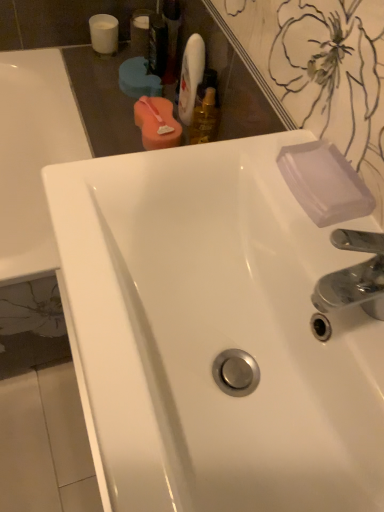
What do you see at coordinates (104, 33) in the screenshot? Image resolution: width=384 pixels, height=512 pixels. I see `white matte cup at upper left, the first mouthwash in the left-to-right sequence` at bounding box center [104, 33].

Describe the element at coordinates (140, 32) in the screenshot. The height and width of the screenshot is (512, 384). I see `clear plastic bottle at upper center, the second mouthwash from the left` at that location.

What do you see at coordinates (190, 77) in the screenshot? I see `translucent plastic mouthwash at upper center, the second mouthwash from the right` at bounding box center [190, 77].

Locate an element on the screen. The height and width of the screenshot is (512, 384). white glossy sink at center is located at coordinates tap(215, 334).

The width and height of the screenshot is (384, 512). What do you see at coordinates (215, 334) in the screenshot?
I see `white glossy sink at center` at bounding box center [215, 334].

This screenshot has width=384, height=512. I want to click on white matte cup at upper left, the first mouthwash in the left-to-right sequence, so click(104, 33).

Could you measure the distance between gold metallic mouthwash at upper center, which is the sixth mouthwash from left to right, and pink sponge at upper center, acting as the fourth mouthwash starting from the left?

They are 8.44 centimeters apart.

Is gold metallic mouthwash at upper center, which is the 1th mouthwash from right to left, next to pink sponge at upper center, acting as the fourth mouthwash starting from the left, and touching it?

Yes, gold metallic mouthwash at upper center, which is the 1th mouthwash from right to left, is next to pink sponge at upper center, acting as the fourth mouthwash starting from the left.

In the image, there is a pink sponge at upper center, acting as the fourth mouthwash starting from the left. At what (x,y) coordinates should I click in order to perform the action: click on mouthwash below it (from the image's perspective). Please return your answer as a coordinate pair (x, y). The width and height of the screenshot is (384, 512). Looking at the image, I should click on (205, 119).

Considering the positions of points (217, 130) and (168, 141), is point (217, 130) farther from camera compared to point (168, 141)?

No, (217, 130) is in front of (168, 141).

Is white glossy sink at center facing away from gold metallic mouthwash at upper center, which is the sixth mouthwash from left to right?

No, white glossy sink at center's orientation is not away from gold metallic mouthwash at upper center, which is the sixth mouthwash from left to right.

Between white glossy sink at center and gold metallic mouthwash at upper center, which is the sixth mouthwash from left to right, which one has larger width?

With larger width is white glossy sink at center.

Can you tell me how much white glossy sink at center and gold metallic mouthwash at upper center, which is the 1th mouthwash from right to left, differ in facing direction?

The facing directions of white glossy sink at center and gold metallic mouthwash at upper center, which is the 1th mouthwash from right to left, are 0.14 degrees apart.

Which is behind, point (95, 345) or point (198, 118)?

The point (198, 118) is farther.

Is gold metallic mouthwash at upper center, which is the 1th mouthwash from right to left, surrounded by clear plastic bottle at upper center, which is counted as the fifth mouthwash, starting from the right?

No.

Find the location of a particular element. mouthwash that is the 5th object located below the clear plastic bottle at upper center, which is counted as the fifth mouthwash, starting from the right (from the image's perspective) is located at coordinates (205, 119).

Between clear plastic bottle at upper center, the second mouthwash from the left, and gold metallic mouthwash at upper center, which is the sixth mouthwash from left to right, which one is positioned in front?

gold metallic mouthwash at upper center, which is the sixth mouthwash from left to right, is closer to the camera.

Is there a large distance between transparent plastic mouthwash at upper center, which is the third mouthwash from left to right, and pink sponge at upper center, marked as the third mouthwash in a right-to-left arrangement?

No.

Between point (153, 15) and point (153, 116), which one is positioned in front?

The point (153, 116) is in front.

Looking at the image, does transparent plastic mouthwash at upper center, which is the third mouthwash from left to right, seem bigger or smaller compared to pink sponge at upper center, acting as the fourth mouthwash starting from the left?

Clearly, transparent plastic mouthwash at upper center, which is the third mouthwash from left to right, is smaller in size than pink sponge at upper center, acting as the fourth mouthwash starting from the left.

From the image's perspective, does transparent plastic mouthwash at upper center, which is the third mouthwash from left to right, appear higher than pink sponge at upper center, marked as the third mouthwash in a right-to-left arrangement?

Correct, transparent plastic mouthwash at upper center, which is the third mouthwash from left to right, appears higher than pink sponge at upper center, marked as the third mouthwash in a right-to-left arrangement, in the image.

Is transparent plastic mouthwash at upper center, which is the third mouthwash from left to right, taller or shorter than transparent plastic soap at upper right?

Clearly, transparent plastic mouthwash at upper center, which is the third mouthwash from left to right, is taller compared to transparent plastic soap at upper right.

From a real-world perspective, relative to transparent plastic soap at upper right, is transparent plastic mouthwash at upper center, which is the third mouthwash from left to right, vertically above or below?

transparent plastic mouthwash at upper center, which is the third mouthwash from left to right, is below transparent plastic soap at upper right.

Considering the positions of objects transparent plastic mouthwash at upper center, arranged as the 4th mouthwash when viewed from the right, and transparent plastic soap at upper right in the image provided, who is in front, transparent plastic mouthwash at upper center, arranged as the 4th mouthwash when viewed from the right, or transparent plastic soap at upper right?

transparent plastic soap at upper right is more forward.

Is transparent plastic mouthwash at upper center, arranged as the 4th mouthwash when viewed from the right, next to transparent plastic soap at upper right and touching it?

No, transparent plastic mouthwash at upper center, arranged as the 4th mouthwash when viewed from the right, is not beside transparent plastic soap at upper right.

Can you confirm if gold metallic mouthwash at upper center, which is the 1th mouthwash from right to left, is thinner than transparent plastic mouthwash at upper center, arranged as the 4th mouthwash when viewed from the right?

In fact, gold metallic mouthwash at upper center, which is the 1th mouthwash from right to left, might be wider than transparent plastic mouthwash at upper center, arranged as the 4th mouthwash when viewed from the right.

From a real-world perspective, is gold metallic mouthwash at upper center, which is the 1th mouthwash from right to left, physically below transparent plastic mouthwash at upper center, arranged as the 4th mouthwash when viewed from the right?

Correct, in the physical world, gold metallic mouthwash at upper center, which is the 1th mouthwash from right to left, is lower than transparent plastic mouthwash at upper center, arranged as the 4th mouthwash when viewed from the right.

Considering the sizes of objects gold metallic mouthwash at upper center, which is the sixth mouthwash from left to right, and transparent plastic mouthwash at upper center, which is the third mouthwash from left to right, in the image provided, who is bigger, gold metallic mouthwash at upper center, which is the sixth mouthwash from left to right, or transparent plastic mouthwash at upper center, which is the third mouthwash from left to right,?

Bigger between the two is transparent plastic mouthwash at upper center, which is the third mouthwash from left to right.

Is the position of gold metallic mouthwash at upper center, which is the sixth mouthwash from left to right, more distant than that of white matte cup at upper left, positioned as the sixth mouthwash in right-to-left order?

No, it is in front of white matte cup at upper left, positioned as the sixth mouthwash in right-to-left order.

Considering the points (215, 113) and (111, 19), which point is in front, point (215, 113) or point (111, 19)?

Point (215, 113)

From a real-world perspective, is gold metallic mouthwash at upper center, which is the sixth mouthwash from left to right, physically located above or below white matte cup at upper left, the first mouthwash in the left-to-right sequence?

In terms of real-world spatial position, gold metallic mouthwash at upper center, which is the sixth mouthwash from left to right, is above white matte cup at upper left, the first mouthwash in the left-to-right sequence.

Where is `the 3rd mouthwash directly beneath the gold metallic mouthwash at upper center, which is the 1th mouthwash from right to left (from a real-world perspective)`? The width and height of the screenshot is (384, 512). the 3rd mouthwash directly beneath the gold metallic mouthwash at upper center, which is the 1th mouthwash from right to left (from a real-world perspective) is located at coordinates (157, 123).

At what (x,y) coordinates should I click in order to perform the action: click on sink on the left of gold metallic mouthwash at upper center, which is the 1th mouthwash from right to left. Please return your answer as a coordinate pair (x, y). Looking at the image, I should click on (215, 334).

When comparing their distances from clear plastic bottle at upper center, which is counted as the fifth mouthwash, starting from the right, does white matte cup at upper left, the first mouthwash in the left-to-right sequence, or gold metallic mouthwash at upper center, which is the 1th mouthwash from right to left, seem further?

The object further to clear plastic bottle at upper center, which is counted as the fifth mouthwash, starting from the right, is gold metallic mouthwash at upper center, which is the 1th mouthwash from right to left.

Considering their positions, is transparent plastic soap at upper right positioned further to white glossy sink at center than translucent plastic mouthwash at upper center, placed as the 5th mouthwash when sorted from left to right?

The object further to white glossy sink at center is translucent plastic mouthwash at upper center, placed as the 5th mouthwash when sorted from left to right.

From the image, which object appears to be farther from pink sponge at upper center, acting as the fourth mouthwash starting from the left, white matte cup at upper left, the first mouthwash in the left-to-right sequence, or transparent plastic soap at upper right?

Based on the image, transparent plastic soap at upper right appears to be further to pink sponge at upper center, acting as the fourth mouthwash starting from the left.

Considering their positions, is clear plastic bottle at upper center, which is counted as the fifth mouthwash, starting from the right, positioned further to transparent plastic mouthwash at upper center, which is the third mouthwash from left to right, than translucent plastic mouthwash at upper center, placed as the 5th mouthwash when sorted from left to right?

translucent plastic mouthwash at upper center, placed as the 5th mouthwash when sorted from left to right, is further to transparent plastic mouthwash at upper center, which is the third mouthwash from left to right.

Based on their spatial positions, is pink sponge at upper center, acting as the fourth mouthwash starting from the left, or clear plastic bottle at upper center, which is counted as the fifth mouthwash, starting from the right, further from translucent plastic mouthwash at upper center, the second mouthwash from the right?

clear plastic bottle at upper center, which is counted as the fifth mouthwash, starting from the right, is further to translucent plastic mouthwash at upper center, the second mouthwash from the right.

When comparing their distances from pink sponge at upper center, acting as the fourth mouthwash starting from the left, does white matte cup at upper left, the first mouthwash in the left-to-right sequence, or transparent plastic mouthwash at upper center, which is the third mouthwash from left to right, seem further?

white matte cup at upper left, the first mouthwash in the left-to-right sequence.

Which object lies further to the anchor point pink sponge at upper center, marked as the third mouthwash in a right-to-left arrangement, translucent plastic mouthwash at upper center, the second mouthwash from the right, or clear plastic bottle at upper center, the second mouthwash from the left?

Among the two, clear plastic bottle at upper center, the second mouthwash from the left, is located further to pink sponge at upper center, marked as the third mouthwash in a right-to-left arrangement.

Estimate the real-world distances between objects in this image. Which object is closer to pink sponge at upper center, acting as the fourth mouthwash starting from the left, clear plastic bottle at upper center, which is counted as the fifth mouthwash, starting from the right, or white matte cup at upper left, positioned as the sixth mouthwash in right-to-left order?

Based on the image, clear plastic bottle at upper center, which is counted as the fifth mouthwash, starting from the right, appears to be nearer to pink sponge at upper center, acting as the fourth mouthwash starting from the left.

Locate an element on the screen. The height and width of the screenshot is (512, 384). soap located between white glossy sink at center and pink sponge at upper center, acting as the fourth mouthwash starting from the left, in the depth direction is located at coordinates (324, 183).

The width and height of the screenshot is (384, 512). Identify the location of mouthwash that lies between transparent plastic mouthwash at upper center, which is the third mouthwash from left to right, and pink sponge at upper center, marked as the third mouthwash in a right-to-left arrangement, from top to bottom. (190, 77).

Image resolution: width=384 pixels, height=512 pixels. I want to click on soap between white glossy sink at center and clear plastic bottle at upper center, the second mouthwash from the left, along the z-axis, so click(x=324, y=183).

The image size is (384, 512). Find the location of `soap positioned between white glossy sink at center and gold metallic mouthwash at upper center, which is the 1th mouthwash from right to left, from near to far`. soap positioned between white glossy sink at center and gold metallic mouthwash at upper center, which is the 1th mouthwash from right to left, from near to far is located at coordinates (324, 183).